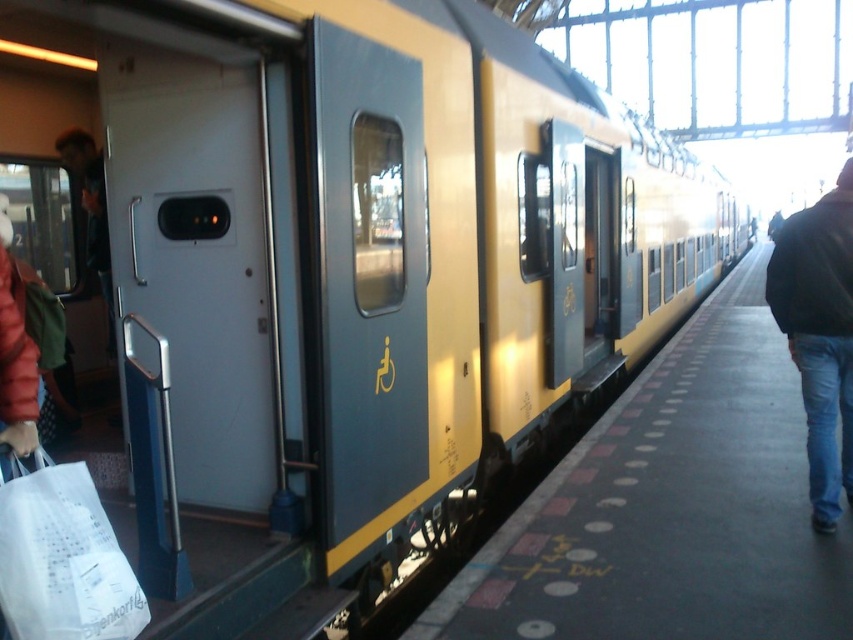
You are a passenger on the platform holding a white paper bag at lower left and a black leather jacket at right. You want to place both items on the bench behind you. The bench has a width of 1 meter. Can both items fit side by side on the bench?

The white paper bag at lower left is wider than the black leather jacket at right. Since the bench is 1 meter wide, and the combined width of both items is less than or equal to 1 meter, they can fit side by side.

Based on the photo, you are a passenger carrying a heavy backpack and need to board the train. You see the concrete platform at center and the black leather jacket at right. Which object is lower in height?

The concrete platform at center is located below the black leather jacket at right, so the concrete platform at center is lower in height.

You are a passenger waiting on the concrete platform at center. You see a black leather jacket at right. If you want to pick up the jacket, which direction should you move towards?

The concrete platform at center is in front of the black leather jacket at right, so you should move towards the right to pick up the jacket.